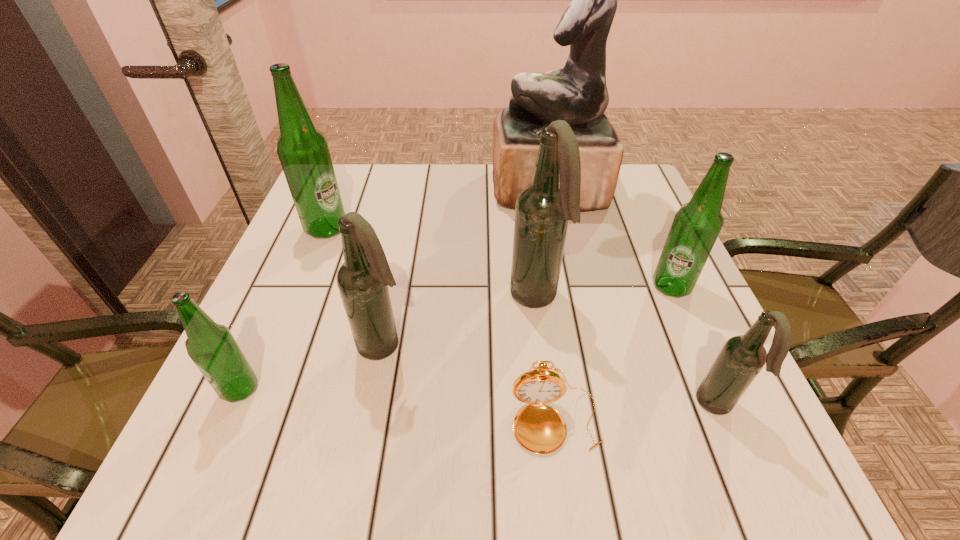
You are a GUI agent. You are given a task and a screenshot of the screen. Output one action in this format:
    pyautogui.click(x=<x>, y=<y>)
    Task: Click on the smallest dark beer bottle
    The image size is (960, 540).
    Given the screenshot: What is the action you would take?
    pyautogui.click(x=742, y=357)

You are a GUI agent. You are given a task and a screenshot of the screen. Output one action in this format:
    pyautogui.click(x=<x>, y=<y>)
    Task: Click on the smallest green beer bottle
    The height and width of the screenshot is (540, 960).
    Given the screenshot: What is the action you would take?
    pyautogui.click(x=211, y=346)

I want to click on pocket watch, so click(539, 428).

Where is `free location located in a relaxed pose on the sculpture`? free location located in a relaxed pose on the sculpture is located at coordinates (344, 190).

At what (x,y) coordinates should I click in order to perform the action: click on free spot located in a relaxed pose on the sculpture. Please return your answer as a coordinate pair (x, y). Looking at the image, I should click on (437, 190).

Where is `vacant space located 0.090m in a relaxed pose on the sculpture`? The height and width of the screenshot is (540, 960). vacant space located 0.090m in a relaxed pose on the sculpture is located at coordinates (459, 190).

Identify the location of free region located 0.120m on the label of the farthest beer bottle. The height and width of the screenshot is (540, 960). (398, 228).

I want to click on free space located on the left of the farthest dark beer bottle, so click(x=407, y=298).

The image size is (960, 540). Find the location of `free location located on the left of the third object from left to right`. free location located on the left of the third object from left to right is located at coordinates (249, 345).

The image size is (960, 540). I want to click on vacant space located 0.270m on the label of the rightmost green beer bottle, so click(x=733, y=426).